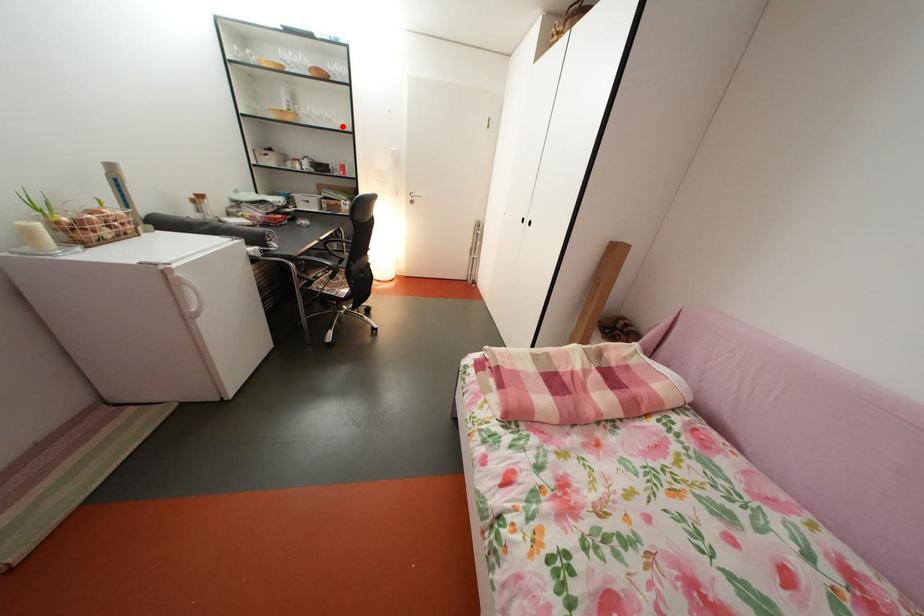
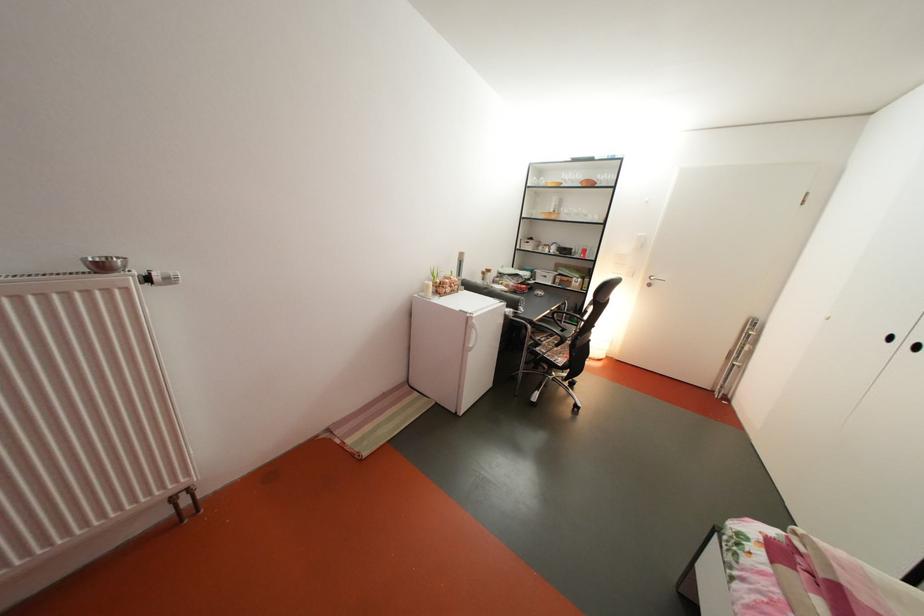
Find the pixel in the second image that matches the highlighted location in the first image.

(598, 222)